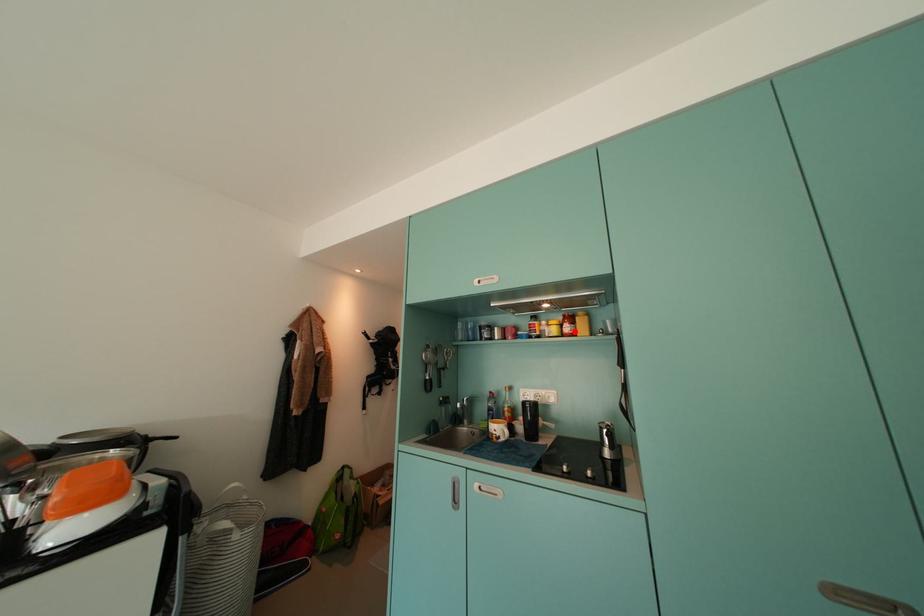
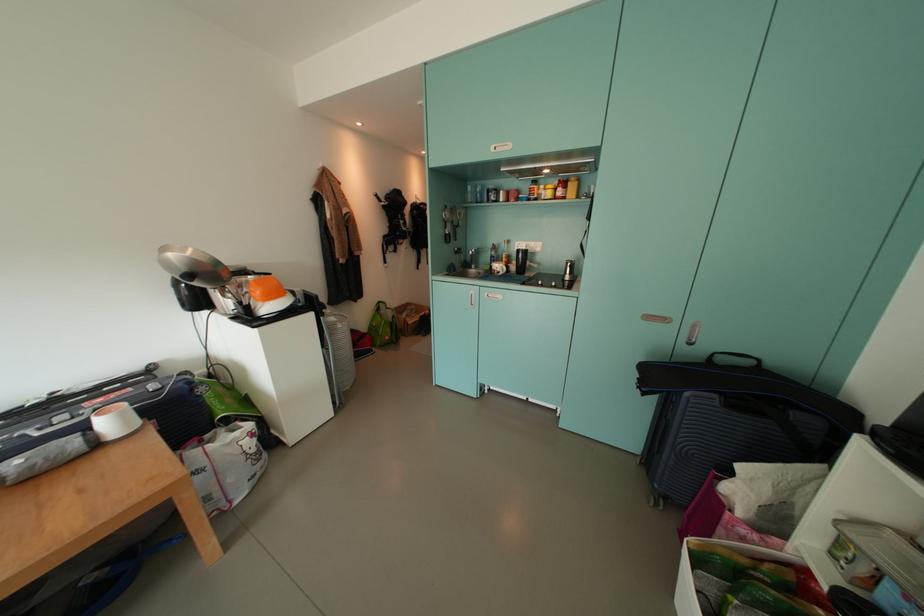
In the second image, find the point that corresponds to the highlighted location in the first image.

(566, 195)